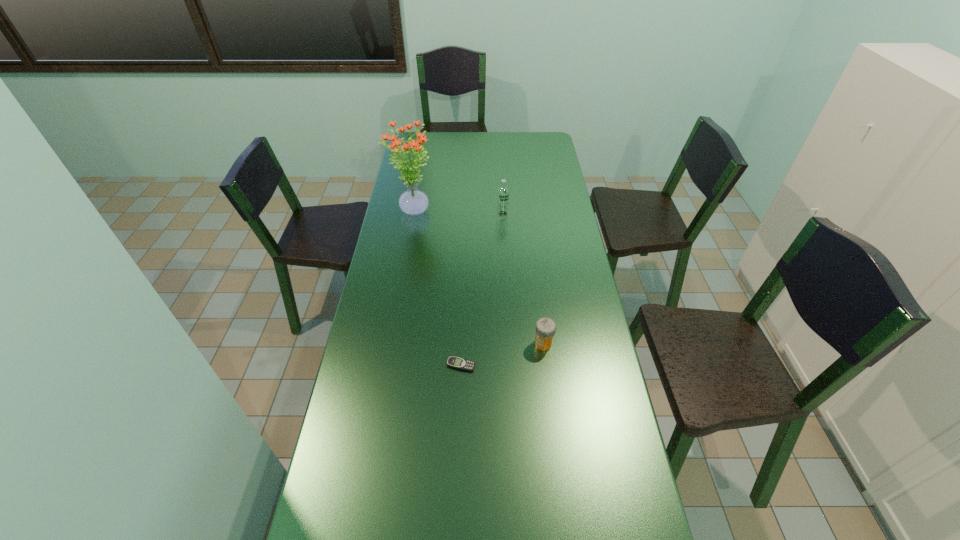
What are the coordinates of `flower arrangement` in the screenshot? It's located at (413, 202).

Find the location of a particular element. the tallest object is located at coordinates (413, 202).

Where is `vodka`? This screenshot has width=960, height=540. vodka is located at coordinates (503, 192).

Locate an element on the screen. the second object from right to left is located at coordinates (503, 192).

Locate an element on the screen. This screenshot has width=960, height=540. the rightmost object is located at coordinates (545, 328).

Find the location of a particular element. the second shortest object is located at coordinates (545, 328).

Locate an element on the screen. Image resolution: width=960 pixels, height=540 pixels. the nearest object is located at coordinates (454, 362).

In order to click on the third object from right to left in this screenshot , I will do `click(454, 362)`.

Where is `vacant space situated on the front of the leftmost object`? This screenshot has width=960, height=540. vacant space situated on the front of the leftmost object is located at coordinates (404, 260).

You are a GUI agent. You are given a task and a screenshot of the screen. Output one action in this format:
    pyautogui.click(x=<x>, y=<y>)
    Task: Click on the free space located 0.360m on the front label of the second object from right to left
    The image size is (960, 540).
    Given the screenshot: What is the action you would take?
    pyautogui.click(x=506, y=279)